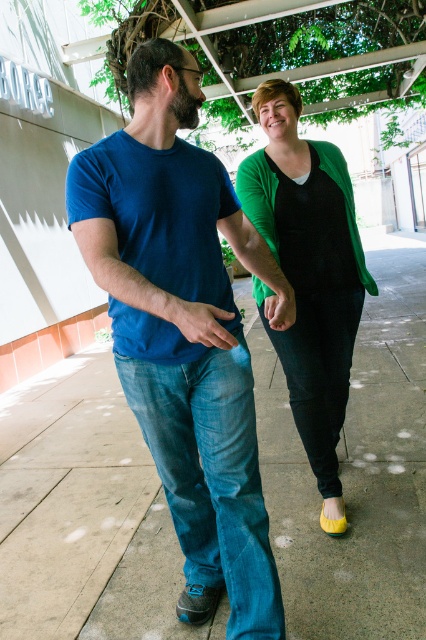
Who is positioned more to the right, blue denim jeans at left or denim jeans at center?

denim jeans at center

Between blue denim jeans at left and denim jeans at center, which one is positioned higher?

blue denim jeans at left is above.

Is point (164, 364) farther from viewer compared to point (175, 378)?

No, (164, 364) is in front of (175, 378).

Identify the location of blue denim jeans at left. (181, 332).

Does point (357, 317) come closer to viewer compared to point (213, 320)?

No.

Between point (285, 253) and point (181, 330), which one is positioned behind?

The point (285, 253) is more distant.

Who is more forward, [276,228] or [218,330]?

Point [218,330] is more forward.

Where is `green matte cardigan at center`? The image size is (426, 640). green matte cardigan at center is located at coordinates (308, 275).

Does smooth concrete pavement at center appear on the right side of matte blue jeans at center?

In fact, smooth concrete pavement at center is to the left of matte blue jeans at center.

Is point (29, 502) farther from viewer compared to point (198, 323)?

Yes, it is.

Identify the location of smooth concrete pavement at center. (354, 465).